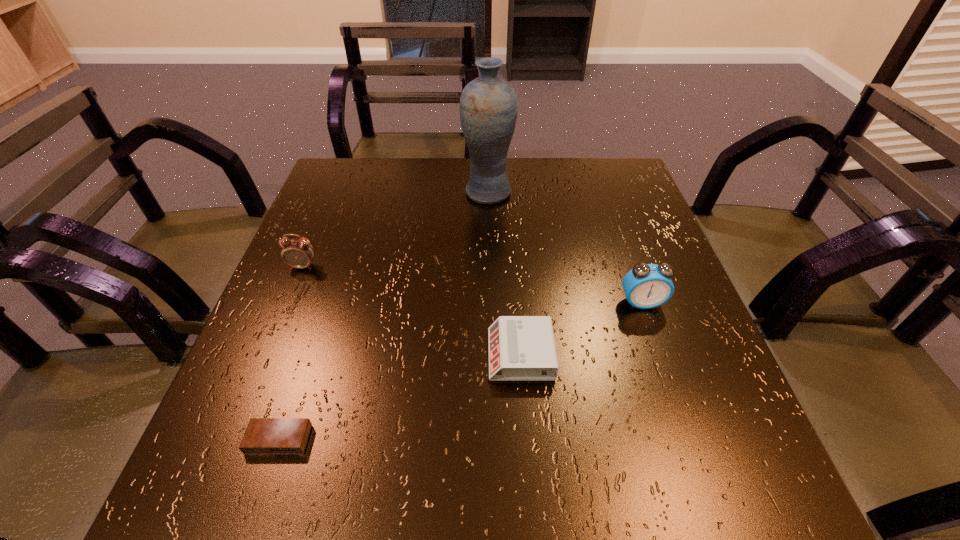
At what (x,y) coordinates should I click in order to perform the action: click on blank area at the left edge. Please return your answer as a coordinate pair (x, y). The width and height of the screenshot is (960, 540). Looking at the image, I should click on (307, 329).

I want to click on vacant region at the right edge, so click(x=684, y=329).

This screenshot has width=960, height=540. Find the location of `free location at the far left corner of the desktop`. free location at the far left corner of the desktop is located at coordinates 369,181.

Find the location of `free spot at the near left corner of the desktop`. free spot at the near left corner of the desktop is located at coordinates (228, 453).

Image resolution: width=960 pixels, height=540 pixels. I want to click on vacant area at the far right corner, so pos(644,198).

This screenshot has width=960, height=540. Find the location of `vacant area that lies between the fourth tallest object and the third nearest object`. vacant area that lies between the fourth tallest object and the third nearest object is located at coordinates 581,328.

Locate an element on the screen. The image size is (960, 540). free space between the farthest alarm clock and the shortest object is located at coordinates (291, 353).

The height and width of the screenshot is (540, 960). Identify the location of vacant space in between the third alarm clock from left to right and the second farthest object. pos(412,310).

Where is `free space between the shortest alarm clock and the rightmost alarm clock`? free space between the shortest alarm clock and the rightmost alarm clock is located at coordinates (461, 371).

Where is `blank region between the shortest alarm clock and the fourth tallest object`? The image size is (960, 540). blank region between the shortest alarm clock and the fourth tallest object is located at coordinates (399, 397).